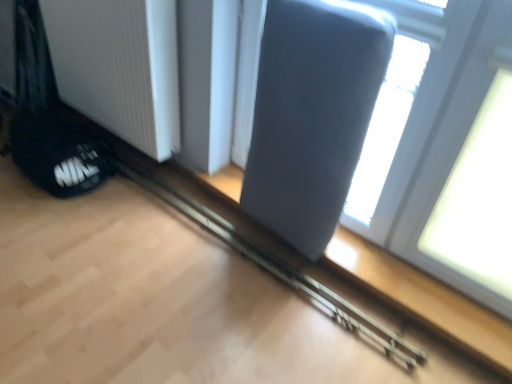
Question: From their relative heights in the image, would you say black mesh shoe at lower left is taller or shorter than suede gray swivel chair at upper right?

Choices:
 (A) short
 (B) tall

Answer: (A)

Question: Do you think black mesh shoe at lower left is within suede gray swivel chair at upper right, or outside of it?

Choices:
 (A) inside
 (B) outside

Answer: (B)

Question: Which is farther from the black mesh shoe at lower left?

Choices:
 (A) white ribbed radiator at lower left
 (B) matte gray cushion at upper right
 (C) suede gray swivel chair at upper right
 (D) metallic gray rail at center

Answer: (B)

Question: Which is farther from the metallic gray rail at center?

Choices:
 (A) suede gray swivel chair at upper right
 (B) black mesh shoe at lower left
 (C) matte gray cushion at upper right
 (D) white ribbed radiator at lower left

Answer: (C)